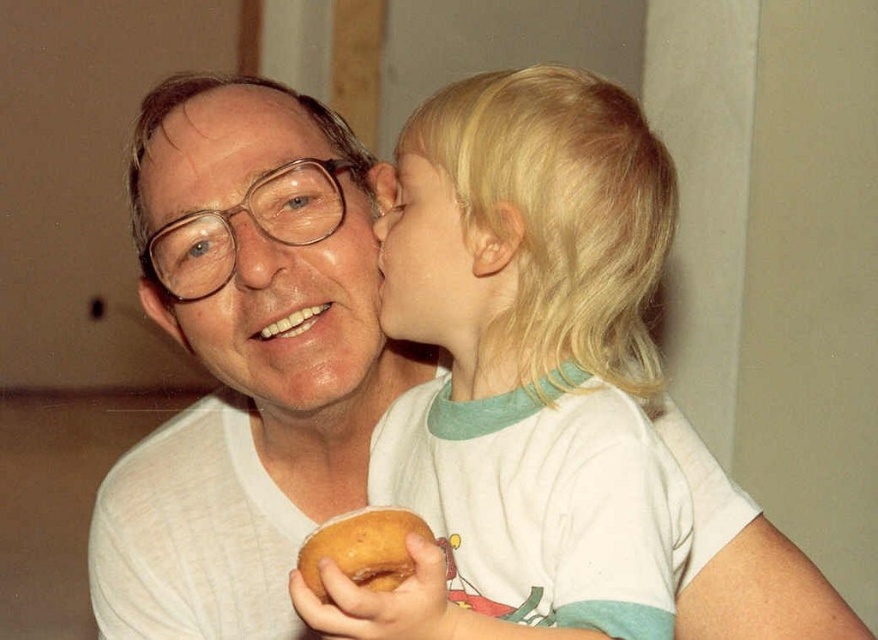
Based on the scene described, which object is positioned higher between the blonde hair at upper center and the golden brown bagel at lower center?

The blonde hair at upper center is positioned higher than the golden brown bagel at lower center.

You are a photographer trying to capture a closeup shot of both the blonde hair at upper center and the golden brown bagel at lower center. Given that your camera can only focus on objects within a 5 inch range, will you be able to capture both in focus?

The blonde hair at upper center is 7.43 inches from the golden brown bagel at lower center. Since the distance between them exceeds the camera focus range of 5 inches, you cannot capture both in focus.

You are a photographer trying to capture a closeup shot of the smooth skin face at center and the blonde hair at upper center. Given that your camera can only focus on objects wider than 10 cm, will both objects be in focus?

The blonde hair at upper center is wider than the smooth skin face at center. Since the camera requires objects wider than 10 cm to focus, we need to know their exact widths. However, the description only states the comparative width between them, not their absolute sizes. Therefore, it is impossible to determine if both will be in focus based on the given information.